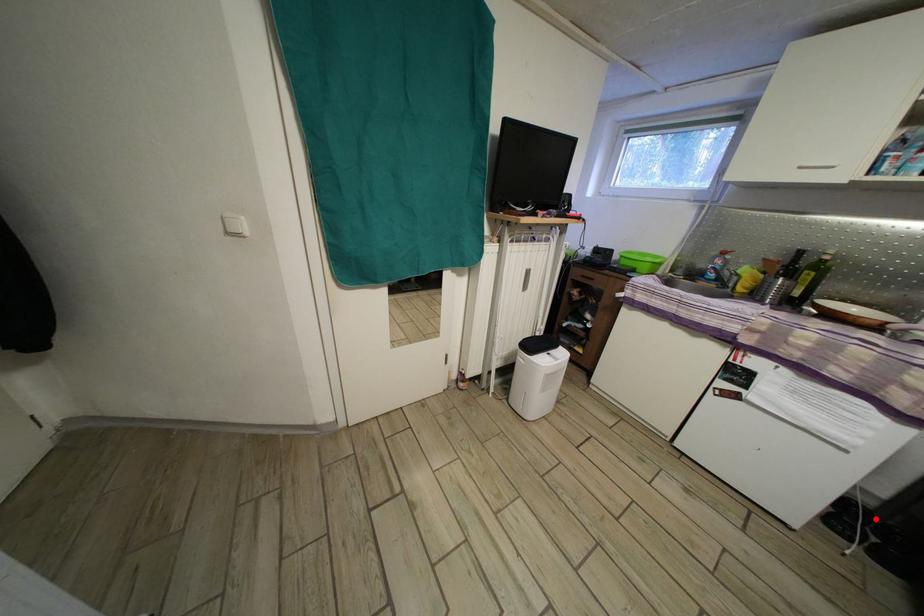
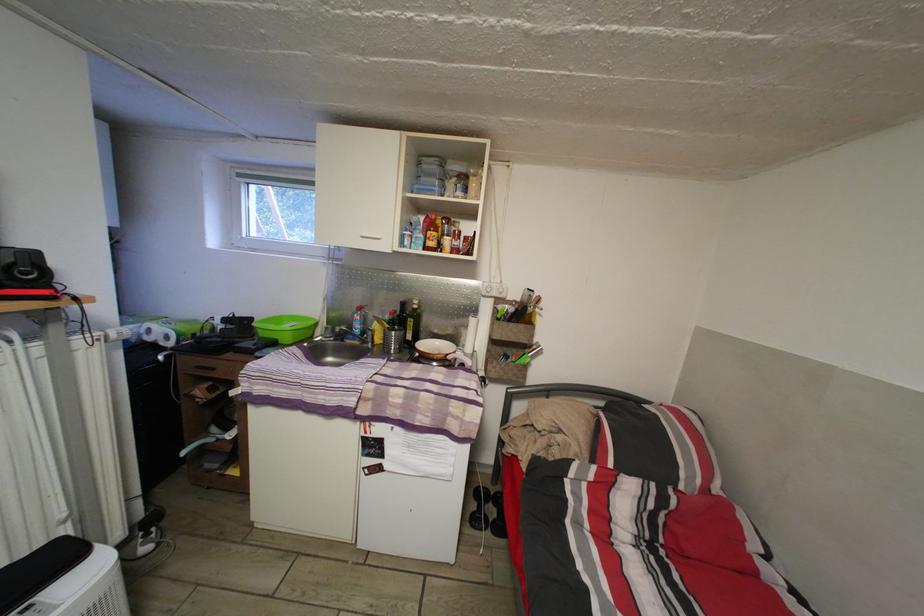
The point at the highlighted location is marked in the first image. Where is the corresponding point in the second image?

(493, 498)